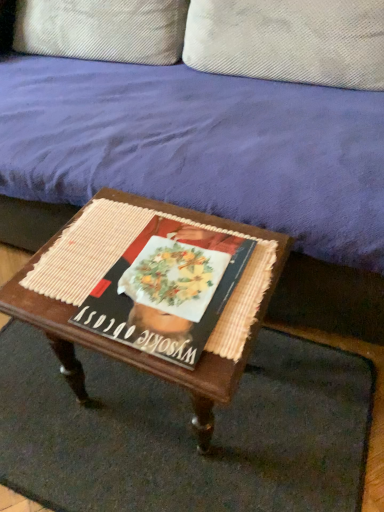
Question: Is woven mat at center further to camera compared to velvet purple couch at upper center?

Choices:
 (A) no
 (B) yes

Answer: (B)

Question: Considering the relative sizes of woven mat at center and velvet purple couch at upper center in the image provided, is woven mat at center taller than velvet purple couch at upper center?

Choices:
 (A) yes
 (B) no

Answer: (B)

Question: Considering the relative positions of woven mat at center and velvet purple couch at upper center in the image provided, is woven mat at center in front of velvet purple couch at upper center?

Choices:
 (A) no
 (B) yes

Answer: (A)

Question: Is woven mat at center not within velvet purple couch at upper center?

Choices:
 (A) no
 (B) yes

Answer: (B)

Question: From a real-world perspective, is woven mat at center on velvet purple couch at upper center?

Choices:
 (A) no
 (B) yes

Answer: (A)

Question: From the image's perspective, is woven mat at center below velvet purple couch at upper center?

Choices:
 (A) no
 (B) yes

Answer: (B)

Question: From the image's perspective, is textured beige pillow at upper center, acting as the second pillow starting from the right, over matte paper magazine at center?

Choices:
 (A) no
 (B) yes

Answer: (B)

Question: Can you confirm if textured beige pillow at upper center, which appears as the first pillow when viewed from the left, is wider than matte paper magazine at center?

Choices:
 (A) yes
 (B) no

Answer: (A)

Question: Is the position of textured beige pillow at upper center, acting as the second pillow starting from the right, more distant than that of matte paper magazine at center?

Choices:
 (A) no
 (B) yes

Answer: (B)

Question: From the image's perspective, is textured beige pillow at upper center, acting as the second pillow starting from the right, under matte paper magazine at center?

Choices:
 (A) yes
 (B) no

Answer: (B)

Question: From a real-world perspective, is textured beige pillow at upper center, acting as the second pillow starting from the right, under matte paper magazine at center?

Choices:
 (A) yes
 (B) no

Answer: (B)

Question: Is textured beige pillow at upper center, acting as the second pillow starting from the right, thinner than matte paper magazine at center?

Choices:
 (A) yes
 (B) no

Answer: (B)

Question: From the image's perspective, does woven wood table at center appear higher than textured beige pillow at upper center, the 2th pillow positioned from the left?

Choices:
 (A) yes
 (B) no

Answer: (B)